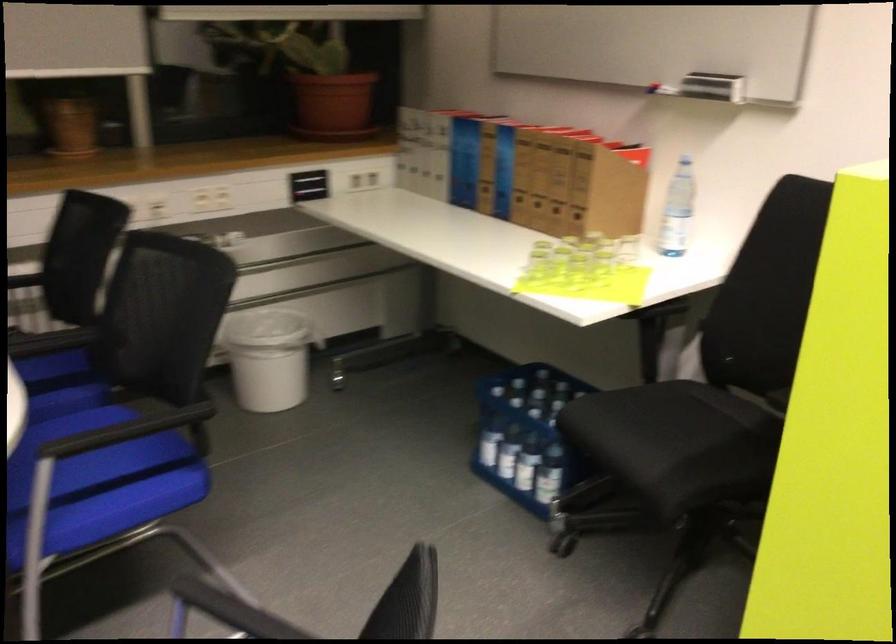
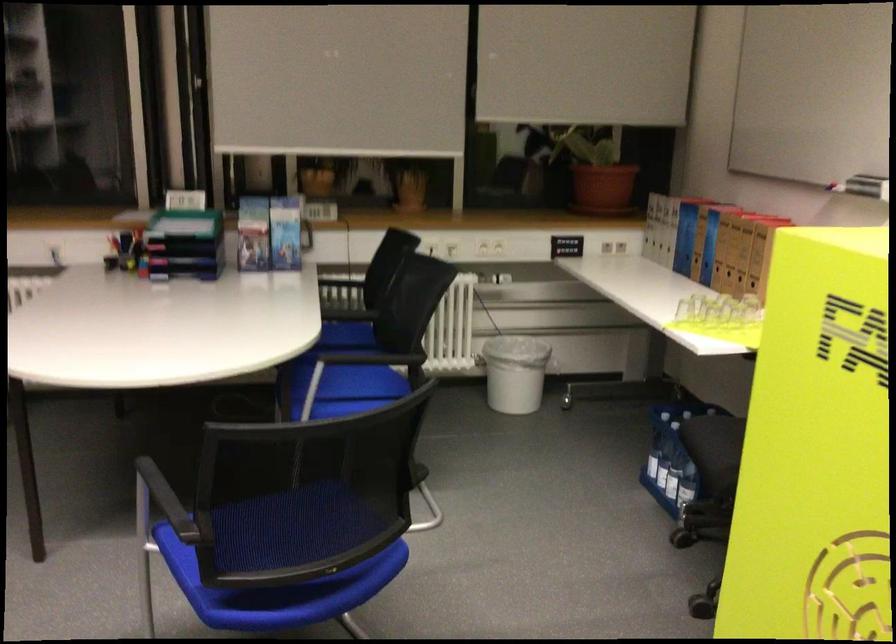
In the second image, find the point that corresponds to point 560,263 in the first image.

(713, 310)